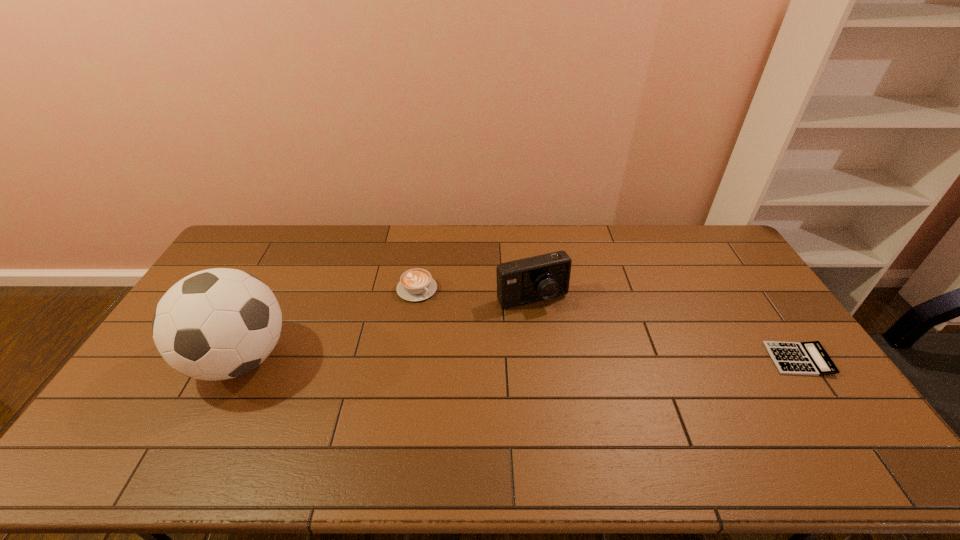
The width and height of the screenshot is (960, 540). I want to click on vacant space situated 0.280m on the side of the cappuccino with the handle, so click(x=483, y=349).

I want to click on free spot located on the side of the cappuccino with the handle, so click(477, 343).

Image resolution: width=960 pixels, height=540 pixels. In order to click on vacant area located 0.050m on the side of the cappuccino with the handle in this screenshot , I will do `click(438, 308)`.

At what (x,y) coordinates should I click in order to perform the action: click on free space located 0.220m on the front-facing side of the third shortest object. Please return your answer as a coordinate pair (x, y). Looking at the image, I should click on (571, 364).

At what (x,y) coordinates should I click in order to perform the action: click on vacant space located on the front-facing side of the third shortest object. Please return your answer as a coordinate pair (x, y). Looking at the image, I should click on (571, 364).

Where is `vacant area situated on the front-facing side of the third shortest object`? This screenshot has height=540, width=960. vacant area situated on the front-facing side of the third shortest object is located at coordinates (553, 329).

The image size is (960, 540). I want to click on object that is at the near edge, so (x=216, y=324).

What are the coordinates of `object that is at the left edge` in the screenshot? It's located at pyautogui.click(x=216, y=324).

I want to click on object that is at the right edge, so click(x=795, y=358).

The width and height of the screenshot is (960, 540). I want to click on object that is at the near left corner, so click(x=216, y=324).